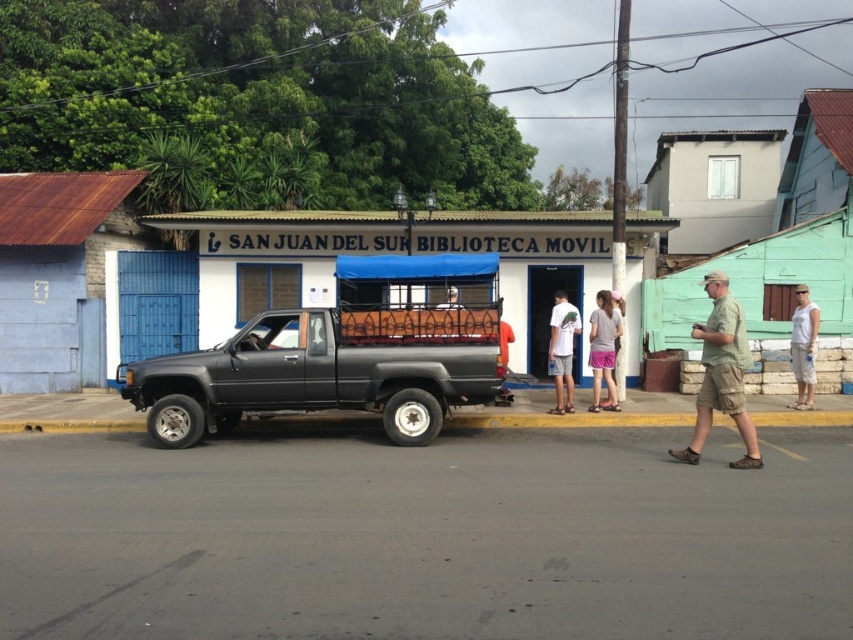
Who is positioned more to the right, green camo shirt at center or white cotton tank top at right?

white cotton tank top at right

What do you see at coordinates (721, 372) in the screenshot? This screenshot has width=853, height=640. I see `green camo shirt at center` at bounding box center [721, 372].

This screenshot has height=640, width=853. Identify the location of green camo shirt at center. (721, 372).

Measure the distance from white cotton shirt at center to white cotton tank top at right.

white cotton shirt at center and white cotton tank top at right are 3.20 meters apart.

Is white cotton shirt at center wider than white cotton tank top at right?

Yes, white cotton shirt at center is wider than white cotton tank top at right.

Where is `white cotton shirt at center`? The width and height of the screenshot is (853, 640). white cotton shirt at center is located at coordinates (561, 349).

Identify the location of white cotton shirt at center. (561, 349).

Between white matte truck at center and white cotton tank top at right, which one appears on the right side from the viewer's perspective?

white cotton tank top at right

Which is more to the left, white matte truck at center or white cotton tank top at right?

Positioned to the left is white matte truck at center.

This screenshot has width=853, height=640. What do you see at coordinates (390, 253) in the screenshot? I see `white matte truck at center` at bounding box center [390, 253].

The height and width of the screenshot is (640, 853). What are the coordinates of `white matte truck at center` in the screenshot? It's located at (390, 253).